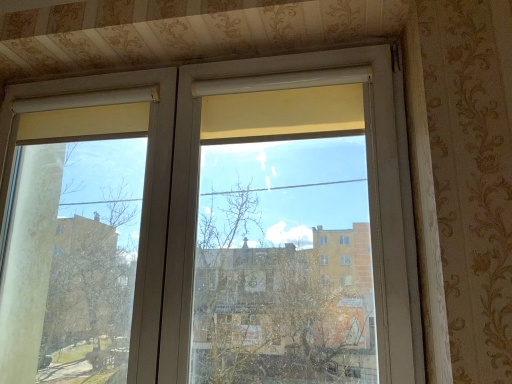
Question: From a real-world perspective, is white matte screen door at upper center physically located above or below transparent glass window at center?

Choices:
 (A) below
 (B) above

Answer: (A)

Question: Is white matte screen door at upper center in front of or behind transparent glass window at center in the image?

Choices:
 (A) front
 (B) behind

Answer: (B)

Question: Which is correct: white matte screen door at upper center is inside transparent glass window at center, or outside of it?

Choices:
 (A) outside
 (B) inside

Answer: (B)

Question: Would you say transparent glass window at center is to the left or to the right of white matte screen door at upper center in the picture?

Choices:
 (A) left
 (B) right

Answer: (B)

Question: Considering the positions of transparent glass window at center and white matte screen door at upper center in the image, is transparent glass window at center bigger or smaller than white matte screen door at upper center?

Choices:
 (A) big
 (B) small

Answer: (B)

Question: From a real-world perspective, is transparent glass window at center positioned above or below white matte screen door at upper center?

Choices:
 (A) above
 (B) below

Answer: (A)

Question: Considering their positions, is transparent glass window at center located in front of or behind white matte screen door at upper center?

Choices:
 (A) behind
 (B) front

Answer: (B)